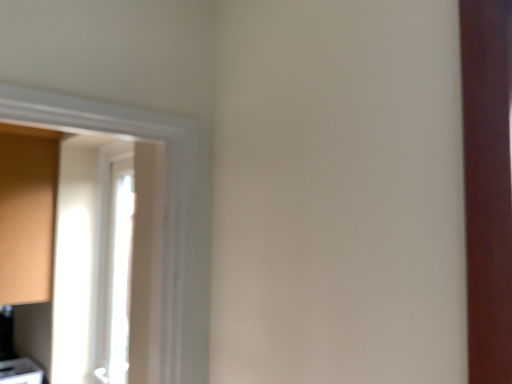
Question: Should I look upward or downward to see white glossy door at left?

Choices:
 (A) down
 (B) up

Answer: (A)

Question: Can you confirm if matte wood cabinet at left, which ranks as the 1th cabinetry in top-to-bottom order, is taller than white glossy door at left?

Choices:
 (A) yes
 (B) no

Answer: (B)

Question: Considering the relative sizes of matte wood cabinet at left, which ranks as the 1th cabinetry in top-to-bottom order, and white glossy door at left in the image provided, is matte wood cabinet at left, which ranks as the 1th cabinetry in top-to-bottom order, shorter than white glossy door at left?

Choices:
 (A) no
 (B) yes

Answer: (B)

Question: Can you confirm if matte wood cabinet at left, placed as the second cabinetry when sorted from bottom to top, is positioned to the right of white glossy door at left?

Choices:
 (A) no
 (B) yes

Answer: (A)

Question: From a real-world perspective, is matte wood cabinet at left, which ranks as the 1th cabinetry in top-to-bottom order, located beneath white glossy door at left?

Choices:
 (A) no
 (B) yes

Answer: (A)

Question: Is matte wood cabinet at left, which ranks as the 1th cabinetry in top-to-bottom order, turned away from white glossy door at left?

Choices:
 (A) no
 (B) yes

Answer: (A)

Question: From a real-world perspective, does matte wood cabinet at left, which ranks as the 1th cabinetry in top-to-bottom order, stand above white glossy door at left?

Choices:
 (A) yes
 (B) no

Answer: (A)

Question: Can you confirm if matte wood cabinet at left, which ranks as the 1th cabinetry in top-to-bottom order, is taller than matte white cabinet at lower left, the second cabinetry positioned from the top?

Choices:
 (A) no
 (B) yes

Answer: (B)

Question: Is matte white cabinet at lower left, placed as the 1th cabinetry when sorted from bottom to top, completely or partially inside matte wood cabinet at left, which ranks as the 1th cabinetry in top-to-bottom order?

Choices:
 (A) yes
 (B) no

Answer: (B)

Question: Does matte wood cabinet at left, placed as the second cabinetry when sorted from bottom to top, appear on the left side of matte white cabinet at lower left, the second cabinetry positioned from the top?

Choices:
 (A) yes
 (B) no

Answer: (A)

Question: Is matte wood cabinet at left, placed as the second cabinetry when sorted from bottom to top, closer to camera compared to matte white cabinet at lower left, the second cabinetry positioned from the top?

Choices:
 (A) yes
 (B) no

Answer: (A)

Question: Is matte wood cabinet at left, placed as the second cabinetry when sorted from bottom to top, shorter than matte white cabinet at lower left, the second cabinetry positioned from the top?

Choices:
 (A) yes
 (B) no

Answer: (B)

Question: Is matte wood cabinet at left, which ranks as the 1th cabinetry in top-to-bottom order, positioned with its back to matte white cabinet at lower left, the second cabinetry positioned from the top?

Choices:
 (A) no
 (B) yes

Answer: (A)

Question: From the image's perspective, would you say matte white cabinet at lower left, the second cabinetry positioned from the top, is shown under white glossy door at left?

Choices:
 (A) yes
 (B) no

Answer: (A)